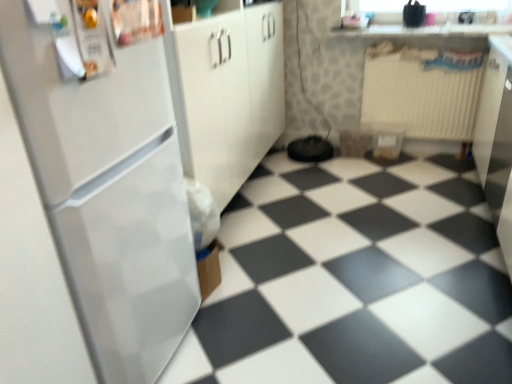
Question: In terms of size, does white glossy tile at lower left appear bigger or smaller than white glossy countertop at upper center?

Choices:
 (A) small
 (B) big

Answer: (B)

Question: Is point (456, 221) positioned closer to the camera than point (373, 23)?

Choices:
 (A) closer
 (B) farther

Answer: (A)

Question: Which of these objects is positioned closest to the white glossy refrigerator at left?

Choices:
 (A) white plastic radiator at upper right
 (B) white glossy tile at lower left
 (C) white glossy countertop at upper center

Answer: (B)

Question: Estimate the real-world distances between objects in this image. Which object is closer to the white plastic radiator at upper right?

Choices:
 (A) white glossy refrigerator at left
 (B) white glossy tile at lower left
 (C) white glossy countertop at upper center

Answer: (C)